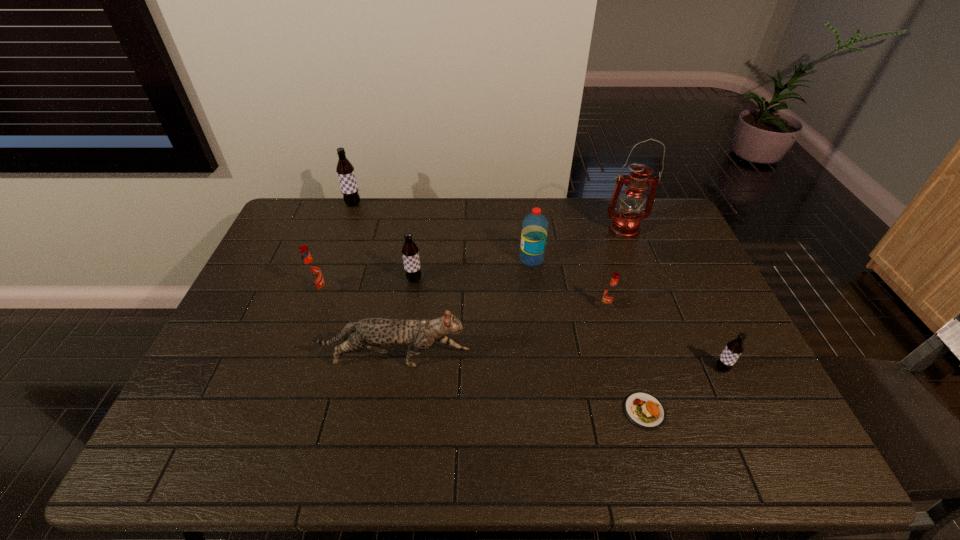
Image resolution: width=960 pixels, height=540 pixels. Find the location of `oil lamp`. oil lamp is located at coordinates (625, 224).

You are a GUI agent. You are given a task and a screenshot of the screen. Output one action in this format:
    pyautogui.click(x=<x>, y=<y>)
    Task: Click on the tallest object
    This screenshot has width=960, height=540.
    Given the screenshot: What is the action you would take?
    pyautogui.click(x=625, y=224)

This screenshot has width=960, height=540. What are the coordinates of `the farthest object` in the screenshot? It's located at (345, 170).

Identify the location of the farthest brown root beer. The image size is (960, 540). (345, 170).

Find the location of a particular element. The height and width of the screenshot is (540, 960). water bottle is located at coordinates (535, 225).

Find the location of a particular element. This screenshot has height=540, width=960. the fifth object from right to left is located at coordinates (535, 225).

Where is `the third farthest root beer`? The height and width of the screenshot is (540, 960). the third farthest root beer is located at coordinates (311, 271).

The width and height of the screenshot is (960, 540). In order to click on the left red root beer in this screenshot , I will do `click(311, 271)`.

Identify the location of the third root beer from right to left. (410, 252).

Identify the location of the second brown root beer from right to left. (410, 252).